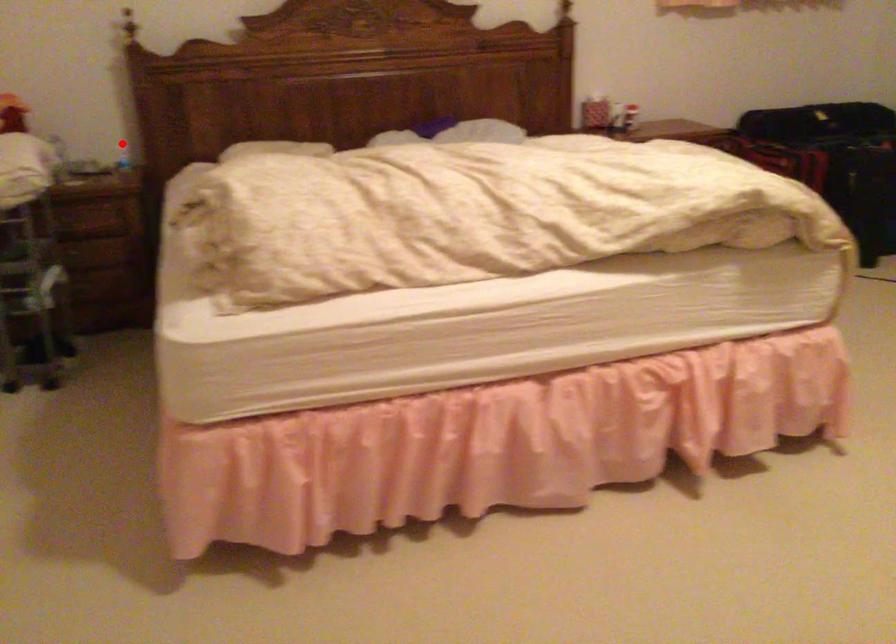
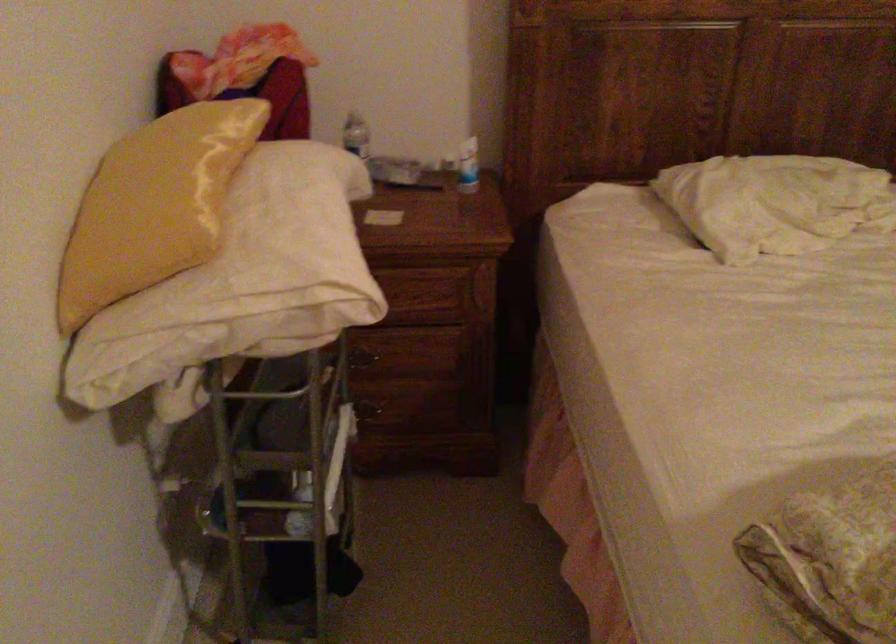
Question: I am providing you with two images of the same scene from different viewpoints. Image1 has a red point marked. In image2, the corresponding 3D location appears at what relative position? Reply with the corresponding letter.

Choices:
 (A) Closer
 (B) Farther

Answer: (A)